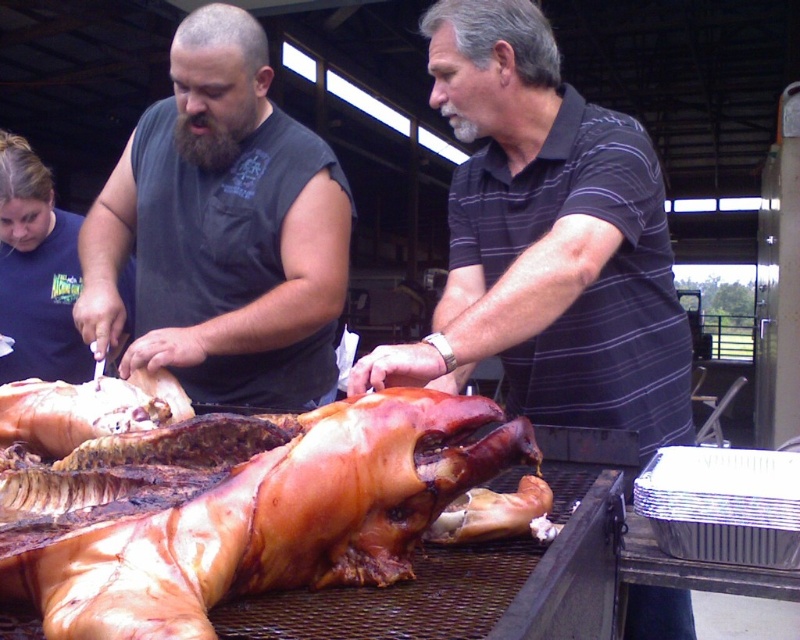
From the picture: Is dark striped shirt at center to the right of brown crispy skin at center from the viewer's perspective?

Correct, you'll find dark striped shirt at center to the right of brown crispy skin at center.

Measure the distance between dark striped shirt at center and brown crispy skin at center.

15.39 inches

Describe the element at coordinates (546, 241) in the screenshot. I see `dark striped shirt at center` at that location.

You are a GUI agent. You are given a task and a screenshot of the screen. Output one action in this format:
    pyautogui.click(x=<x>, y=<y>)
    Task: Click on the dark striped shirt at center
    
    Given the screenshot: What is the action you would take?
    pyautogui.click(x=546, y=241)

Between brown crispy skin at center and dark gray sleeveless shirt at center, which one appears on the left side from the viewer's perspective?

From the viewer's perspective, dark gray sleeveless shirt at center appears more on the left side.

Who is higher up, brown crispy skin at center or dark gray sleeveless shirt at center?

dark gray sleeveless shirt at center is higher up.

Is point (156, 600) more distant than point (328, 340)?

No, (156, 600) is closer to viewer.

Find the location of a particular element. brown crispy skin at center is located at coordinates (240, 509).

Is dark striped shirt at center to the right of dark gray sleeveless shirt at center from the viewer's perspective?

Correct, you'll find dark striped shirt at center to the right of dark gray sleeveless shirt at center.

How far apart are dark striped shirt at center and dark gray sleeveless shirt at center?

A distance of 21.17 inches exists between dark striped shirt at center and dark gray sleeveless shirt at center.

Does point (454, 269) come behind point (204, 301)?

No, (454, 269) is closer to viewer.

The height and width of the screenshot is (640, 800). In order to click on dark striped shirt at center in this screenshot , I will do `click(546, 241)`.